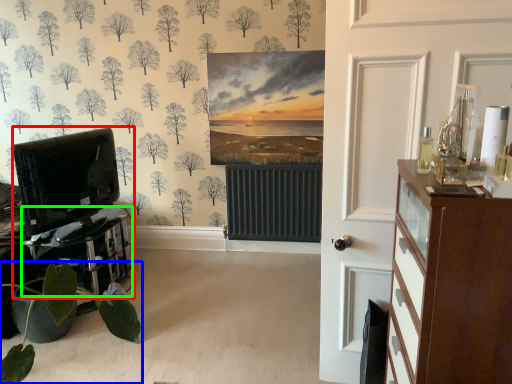
Question: Which object is the closest to the entertainment center (highlighted by a red box)? Choose among these: houseplant (highlighted by a blue box) or table (highlighted by a green box).

Choices:
 (A) houseplant
 (B) table

Answer: (B)